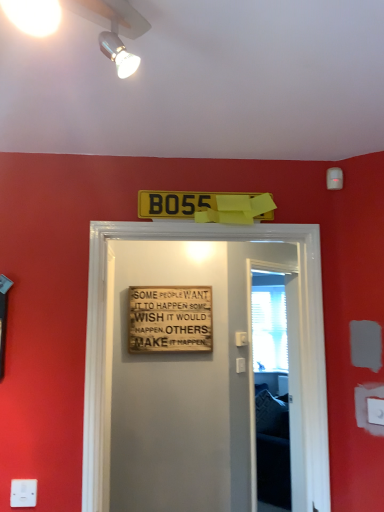
Identify the location of wooden sign at center, acting as the 1th warning sign starting from the bottom. (170, 319).

What do you see at coordinates (375, 411) in the screenshot? I see `white plastic electric outlet at lower right, which is the second electric outlet in bottom-to-top order` at bounding box center [375, 411].

Measure the distance between white plastic electric outlet at lower right, acting as the first electric outlet starting from the top, and camera.

The distance of white plastic electric outlet at lower right, acting as the first electric outlet starting from the top, from camera is 5.01 feet.

The height and width of the screenshot is (512, 384). Describe the element at coordinates (299, 325) in the screenshot. I see `wooden signboard at center` at that location.

Measure the distance between white plastic electric outlet at lower left, the first electric outlet positioned from the front, and camera.

white plastic electric outlet at lower left, the first electric outlet positioned from the front, and camera are 4.75 feet apart from each other.

Find the location of `yellow plastic license plate at center, which appears as the 1th warning sign when viewed from the front`. yellow plastic license plate at center, which appears as the 1th warning sign when viewed from the front is located at coordinates (206, 206).

What is the approximate width of yellow plastic license plate at center, which appears as the 1th warning sign when viewed from the front?

yellow plastic license plate at center, which appears as the 1th warning sign when viewed from the front, is 2.51 inches in width.

The height and width of the screenshot is (512, 384). What are the coordinates of `white mesh screen at right` in the screenshot? It's located at (269, 322).

How far apart are wooden signboard at center and yellow plastic license plate at center, the 2th warning sign in the bottom-to-top sequence?

9.07 inches.

Is wooden signboard at center positioned behind yellow plastic license plate at center, positioned as the 2th warning sign in back-to-front order?

No.

Where is `door in front of the yellow plastic license plate at center, positioned as the 2th warning sign in back-to-front order`? This screenshot has width=384, height=512. door in front of the yellow plastic license plate at center, positioned as the 2th warning sign in back-to-front order is located at coordinates (299, 325).

Can you confirm if wooden signboard at center is smaller than yellow plastic license plate at center, the 1th warning sign from the top?

No, wooden signboard at center is not smaller than yellow plastic license plate at center, the 1th warning sign from the top.

Considering the sizes of objects yellow plastic license plate at center, which appears as the 1th warning sign when viewed from the front, and white mesh screen at right in the image provided, who is smaller, yellow plastic license plate at center, which appears as the 1th warning sign when viewed from the front, or white mesh screen at right?

With smaller size is yellow plastic license plate at center, which appears as the 1th warning sign when viewed from the front.

Is the depth of yellow plastic license plate at center, which appears as the 1th warning sign when viewed from the front, greater than that of white mesh screen at right?

No, yellow plastic license plate at center, which appears as the 1th warning sign when viewed from the front, is closer to the camera.

Does yellow plastic license plate at center, the 1th warning sign from the top, have a lesser width compared to white mesh screen at right?

No.

Considering the relative sizes of yellow plastic license plate at center, the 1th warning sign from the top, and white mesh screen at right in the image provided, is yellow plastic license plate at center, the 1th warning sign from the top, taller than white mesh screen at right?

No, yellow plastic license plate at center, the 1th warning sign from the top, is not taller than white mesh screen at right.

Considering the points (310, 308) and (30, 488), which point is behind, point (310, 308) or point (30, 488)?

Positioned behind is point (310, 308).

In the scene shown: Considering the sizes of objects wooden signboard at center and white plastic electric outlet at lower left, placed as the 2th electric outlet when sorted from right to left, in the image provided, who is taller, wooden signboard at center or white plastic electric outlet at lower left, placed as the 2th electric outlet when sorted from right to left,?

With more height is wooden signboard at center.

Considering the sizes of wooden signboard at center and white plastic electric outlet at lower left, the 1th electric outlet in the left-to-right sequence, in the image, is wooden signboard at center bigger or smaller than white plastic electric outlet at lower left, the 1th electric outlet in the left-to-right sequence,?

Considering their sizes, wooden signboard at center takes up more space than white plastic electric outlet at lower left, the 1th electric outlet in the left-to-right sequence.

Locate an element on the screen. door on the right of white plastic electric outlet at lower left, the first electric outlet positioned from the front is located at coordinates (299, 325).

Considering the relative positions of yellow plastic license plate at center, positioned as the 2th warning sign in back-to-front order, and white glossy spotlight at upper center in the image provided, is yellow plastic license plate at center, positioned as the 2th warning sign in back-to-front order, to the right of white glossy spotlight at upper center from the viewer's perspective?

Correct, you'll find yellow plastic license plate at center, positioned as the 2th warning sign in back-to-front order, to the right of white glossy spotlight at upper center.

In the scene shown: Choose the correct answer: Is yellow plastic license plate at center, which appears as the 1th warning sign when viewed from the front, inside white glossy spotlight at upper center or outside it?

yellow plastic license plate at center, which appears as the 1th warning sign when viewed from the front, is not inside white glossy spotlight at upper center, it's outside.

From their relative heights in the image, would you say yellow plastic license plate at center, the 2th warning sign in the bottom-to-top sequence, is taller or shorter than white glossy spotlight at upper center?

Clearly, yellow plastic license plate at center, the 2th warning sign in the bottom-to-top sequence, is shorter compared to white glossy spotlight at upper center.

Which object is wider, white plastic electric outlet at lower left, marked as the 2th electric outlet in a back-to-front arrangement, or wooden signboard at center?

wooden signboard at center is wider.

Does white plastic electric outlet at lower left, the 1th electric outlet in the left-to-right sequence, touch wooden signboard at center?

No, white plastic electric outlet at lower left, the 1th electric outlet in the left-to-right sequence, is not touching wooden signboard at center.

Considering the sizes of objects white plastic electric outlet at lower left, which ranks as the first electric outlet in bottom-to-top order, and wooden signboard at center in the image provided, who is bigger, white plastic electric outlet at lower left, which ranks as the first electric outlet in bottom-to-top order, or wooden signboard at center?

wooden signboard at center.

Measure the distance between white plastic electric outlet at lower left, marked as the 2th electric outlet in a back-to-front arrangement, and wooden signboard at center.

The distance of white plastic electric outlet at lower left, marked as the 2th electric outlet in a back-to-front arrangement, from wooden signboard at center is 28.05 inches.

Identify the location of the 1st warning sign in front of the transparent plastic screen door at center. (170, 319).

How many degrees apart are the facing directions of wooden sign at center, arranged as the 2th warning sign when viewed from the front, and transparent plastic screen door at center?

The facing directions of wooden sign at center, arranged as the 2th warning sign when viewed from the front, and transparent plastic screen door at center are 47.7 degrees apart.

From a real-world perspective, which object rests below the other?

From a 3D spatial view, transparent plastic screen door at center is below.

Is wooden sign at center, the 2th warning sign in the top-to-bottom sequence, looking in the opposite direction of transparent plastic screen door at center?

No, wooden sign at center, the 2th warning sign in the top-to-bottom sequence, is not facing the opposite direction of transparent plastic screen door at center.

Considering the positions of points (276, 340) and (379, 412), is point (276, 340) closer to camera compared to point (379, 412)?

No, it is not.

From a real-world perspective, who is located lower, white mesh screen at right or white plastic electric outlet at lower right, marked as the second electric outlet in a front-to-back arrangement?

From a 3D spatial view, white plastic electric outlet at lower right, marked as the second electric outlet in a front-to-back arrangement, is below.

Is white mesh screen at right to the left or to the right of white plastic electric outlet at lower right, which is the 2th electric outlet in left-to-right order, in the image?

Based on their positions, white mesh screen at right is located to the right of white plastic electric outlet at lower right, which is the 2th electric outlet in left-to-right order.

Is white mesh screen at right wider than white plastic electric outlet at lower right, which is the second electric outlet in bottom-to-top order?

In fact, white mesh screen at right might be narrower than white plastic electric outlet at lower right, which is the second electric outlet in bottom-to-top order.

At what (x,y) coordinates should I click in order to perform the action: click on warning sign that is the 2nd one when counting upward from the wooden signboard at center (from the image's perspective). Please return your answer as a coordinate pair (x, y). Looking at the image, I should click on (206, 206).

You are a GUI agent. You are given a task and a screenshot of the screen. Output one action in this format:
    pyautogui.click(x=<x>, y=<y>)
    Task: Click on the window screen behind the yellow plastic license plate at center, the 2th warning sign in the bottom-to-top sequence
    This screenshot has width=384, height=512.
    Given the screenshot: What is the action you would take?
    pyautogui.click(x=269, y=322)

Based on their spatial positions, is white glossy spotlight at upper center or wooden sign at center, positioned as the first warning sign in back-to-front order, closer to yellow plastic license plate at center, the 2th warning sign in the bottom-to-top sequence?

white glossy spotlight at upper center.

Consider the image. Considering their positions, is yellow plastic license plate at center, positioned as the 2th warning sign in back-to-front order, positioned closer to white mesh screen at right than transparent plastic screen door at center?

Among the two, transparent plastic screen door at center is located nearer to white mesh screen at right.

Which object lies further to the anchor point yellow plastic license plate at center, the 2th warning sign in the bottom-to-top sequence, white plastic electric outlet at lower right, marked as the second electric outlet in a front-to-back arrangement, or white mesh screen at right?

The object further to yellow plastic license plate at center, the 2th warning sign in the bottom-to-top sequence, is white mesh screen at right.

Based on their spatial positions, is white glossy spotlight at upper center or white mesh screen at right closer to yellow plastic license plate at center, positioned as the 2th warning sign in back-to-front order?

The object closer to yellow plastic license plate at center, positioned as the 2th warning sign in back-to-front order, is white glossy spotlight at upper center.

Looking at the image, which one is located closer to white plastic electric outlet at lower right, the 1th electric outlet viewed from the right, wooden sign at center, positioned as the first warning sign in back-to-front order, or white plastic electric outlet at lower left, the first electric outlet positioned from the front?

Among the two, white plastic electric outlet at lower left, the first electric outlet positioned from the front, is located nearer to white plastic electric outlet at lower right, the 1th electric outlet viewed from the right.

From the image, which object appears to be farther from wooden sign at center, the 2th warning sign in the top-to-bottom sequence, white plastic electric outlet at lower left, placed as the 2th electric outlet when sorted from right to left, or white mesh screen at right?

white mesh screen at right.

From the image, which object appears to be farther from white mesh screen at right, white plastic electric outlet at lower right, acting as the first electric outlet starting from the top, or white glossy spotlight at upper center?

The object further to white mesh screen at right is white glossy spotlight at upper center.

From the image, which object appears to be farther from wooden signboard at center, white plastic electric outlet at lower left, marked as the 2th electric outlet in a back-to-front arrangement, or yellow plastic license plate at center, the 2th warning sign in the bottom-to-top sequence?

white plastic electric outlet at lower left, marked as the 2th electric outlet in a back-to-front arrangement, is further to wooden signboard at center.

Identify the location of screen door between white plastic electric outlet at lower left, the 1th electric outlet in the left-to-right sequence, and white plastic electric outlet at lower right, which is the second electric outlet in bottom-to-top order. (264, 367).

At what (x,y) coordinates should I click in order to perform the action: click on screen door between wooden sign at center, arranged as the 2th warning sign when viewed from the front, and white mesh screen at right, along the z-axis. Please return your answer as a coordinate pair (x, y). This screenshot has height=512, width=384. Looking at the image, I should click on (264, 367).

Where is `electric outlet between white plastic electric outlet at lower left, the first electric outlet positioned from the front, and white mesh screen at right in the front-back direction`? electric outlet between white plastic electric outlet at lower left, the first electric outlet positioned from the front, and white mesh screen at right in the front-back direction is located at coordinates (375, 411).

Locate an element on the screen. The height and width of the screenshot is (512, 384). door located between white plastic electric outlet at lower left, the first electric outlet positioned from the front, and wooden sign at center, arranged as the 2th warning sign when viewed from the front, in the depth direction is located at coordinates (299, 325).